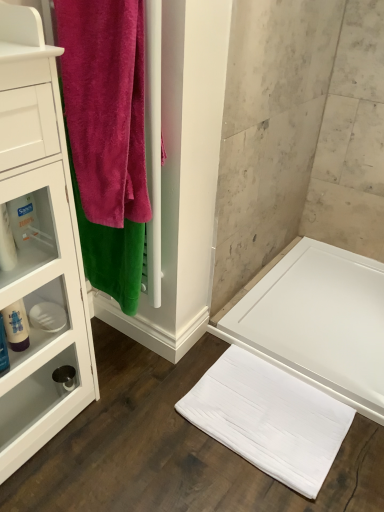
The width and height of the screenshot is (384, 512). In order to click on blank area to the left of white soft towel at lower center in this screenshot , I will do `click(147, 422)`.